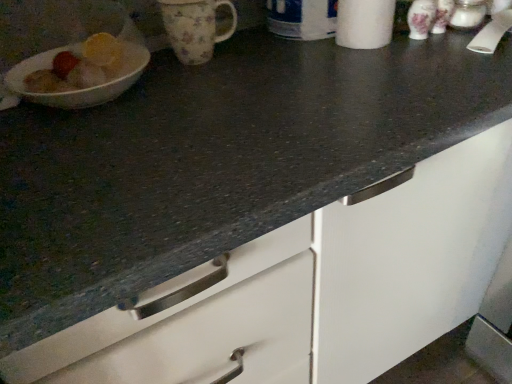
Question: Considering the relative positions of white paper towel at upper right and floral ceramic mug at upper center in the image provided, is white paper towel at upper right to the left or to the right of floral ceramic mug at upper center?

Choices:
 (A) right
 (B) left

Answer: (A)

Question: Does point (360, 0) appear closer or farther from the camera than point (198, 41)?

Choices:
 (A) closer
 (B) farther

Answer: (A)

Question: From a real-world perspective, is white paper towel at upper right physically located above or below floral ceramic mug at upper center?

Choices:
 (A) above
 (B) below

Answer: (A)

Question: Visually, is floral ceramic mug at upper center positioned to the left or to the right of white paper towel at upper right?

Choices:
 (A) right
 (B) left

Answer: (B)

Question: From a real-world perspective, is floral ceramic mug at upper center above or below white paper towel at upper right?

Choices:
 (A) below
 (B) above

Answer: (A)

Question: In the image, is floral ceramic mug at upper center positioned in front of or behind white paper towel at upper right?

Choices:
 (A) behind
 (B) front

Answer: (A)

Question: Considering the positions of floral ceramic mug at upper center and white paper towel at upper right in the image, is floral ceramic mug at upper center taller or shorter than white paper towel at upper right?

Choices:
 (A) tall
 (B) short

Answer: (B)